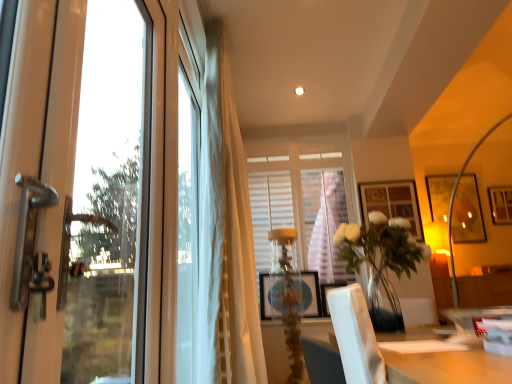
Question: Is matte wooden picture frame at center, acting as the second picture frame starting from the front, closer to the viewer compared to clear glass door at left, which is counted as the 2th window, starting from the right?

Choices:
 (A) no
 (B) yes

Answer: (A)

Question: Would you say clear glass door at left, the first window positioned from the left, is part of matte wooden picture frame at center, the 5th picture frame from the right,'s contents?

Choices:
 (A) yes
 (B) no

Answer: (B)

Question: Does matte wooden picture frame at center, the 1th picture frame viewed from the left, appear on the right side of clear glass door at left, the 1th window viewed from the front?

Choices:
 (A) yes
 (B) no

Answer: (A)

Question: From the image's perspective, would you say matte wooden picture frame at center, acting as the second picture frame starting from the front, is shown under clear glass door at left, which is the 2th window from back to front?

Choices:
 (A) no
 (B) yes

Answer: (B)

Question: Can you confirm if matte wooden picture frame at center, acting as the second picture frame starting from the front, is bigger than clear glass door at left, the 1th window viewed from the front?

Choices:
 (A) no
 (B) yes

Answer: (A)

Question: Is white sheer curtain at center in front of or behind matte wooden picture frame at center, the 1th picture frame viewed from the left, in the image?

Choices:
 (A) behind
 (B) front

Answer: (B)

Question: Looking at their shapes, would you say white sheer curtain at center is wider or thinner than matte wooden picture frame at center, acting as the second picture frame starting from the front?

Choices:
 (A) wide
 (B) thin

Answer: (A)

Question: Is white sheer curtain at center taller or shorter than matte wooden picture frame at center, acting as the second picture frame starting from the front?

Choices:
 (A) short
 (B) tall

Answer: (B)

Question: Is white sheer curtain at center inside or outside of matte wooden picture frame at center, the 1th picture frame viewed from the left?

Choices:
 (A) inside
 (B) outside

Answer: (B)

Question: From the image's perspective, relative to clear glass vase at center, is wooden framed picture at center right, the 3th picture frame in the left-to-right sequence, above or below?

Choices:
 (A) below
 (B) above

Answer: (B)

Question: In the image, is wooden framed picture at center right, the 3th picture frame in the right-to-left sequence, positioned in front of or behind clear glass vase at center?

Choices:
 (A) behind
 (B) front

Answer: (A)

Question: Based on their sizes in the image, would you say wooden framed picture at center right, positioned as the 3th picture frame in front-to-back order, is bigger or smaller than clear glass vase at center?

Choices:
 (A) small
 (B) big

Answer: (A)

Question: Is point (372, 195) closer or farther from the camera than point (374, 233)?

Choices:
 (A) farther
 (B) closer

Answer: (A)

Question: From a real-world perspective, is clear glass door at left, the first window positioned from the left, above or below white sheer curtain at center?

Choices:
 (A) below
 (B) above

Answer: (A)

Question: Visually, is clear glass door at left, the first window positioned from the left, positioned to the left or to the right of white sheer curtain at center?

Choices:
 (A) right
 (B) left

Answer: (B)